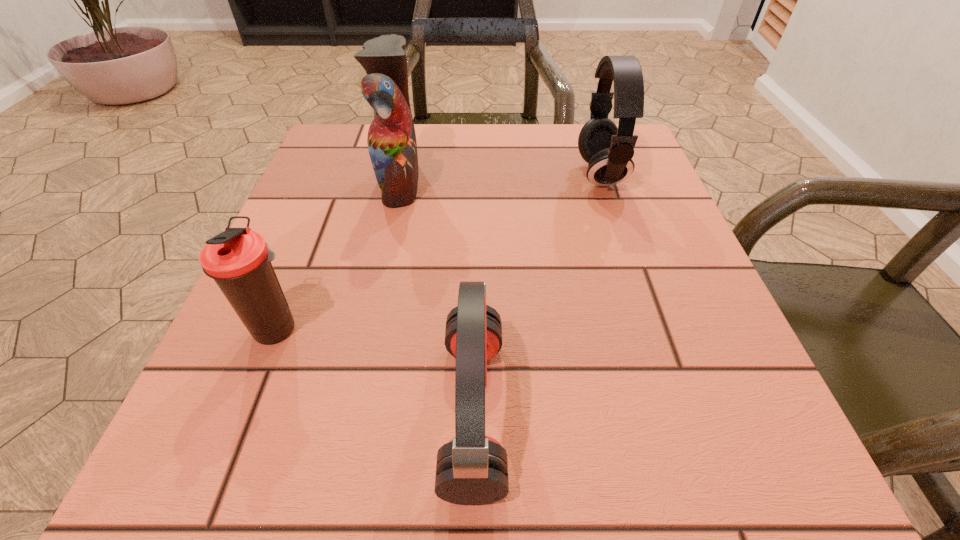
At what (x,y) coordinates should I click in order to perform the action: click on unoccupied position between the nearer earphone and the parrot. Please return your answer as a coordinate pair (x, y). Looking at the image, I should click on (437, 296).

Image resolution: width=960 pixels, height=540 pixels. What are the coordinates of `blank region between the parrot and the leftmost object` in the screenshot? It's located at (339, 255).

Identify the location of empty location between the second object from right to left and the rightmost object. (537, 293).

Where is `unoccupied area between the taller earphone and the leftmost object`? This screenshot has height=540, width=960. unoccupied area between the taller earphone and the leftmost object is located at coordinates (439, 251).

The image size is (960, 540). In order to click on free area in between the parrot and the nearer earphone in this screenshot , I will do `click(437, 296)`.

Identify the location of object that is the third closest one to the farther earphone. The image size is (960, 540). (239, 260).

Where is `object that is the third closest to the parrot`? Image resolution: width=960 pixels, height=540 pixels. object that is the third closest to the parrot is located at coordinates (609, 150).

At what (x,y) coordinates should I click in order to perform the action: click on free region that satisfies the following two spatial constraints: 1. on the ear cups of the farther earphone; 2. on the front side of the thermos bottle. Please return your answer as a coordinate pair (x, y). Looking at the image, I should click on (652, 328).